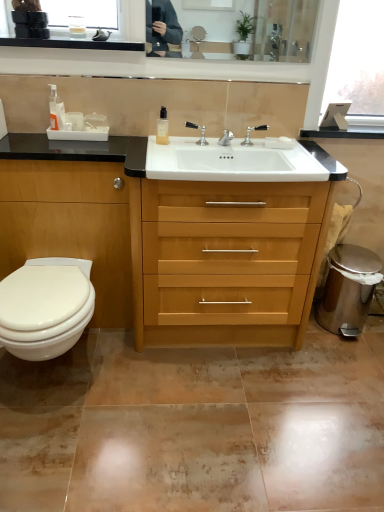
The image size is (384, 512). I want to click on free space between light wood/finish chest of drawers at center and white glossy toilet at lower left, so click(180, 375).